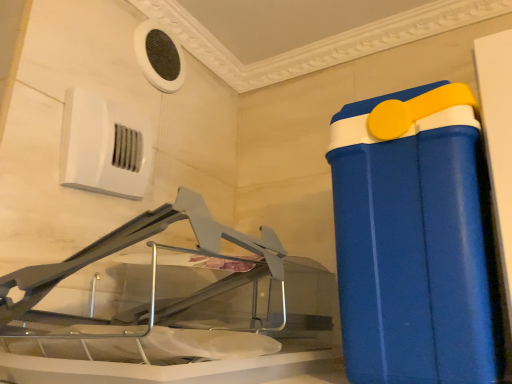
Question: From the image's perspective, is white plastic air conditioning unit at upper left, which appears as the 1th air conditioning when viewed from the front, below white mesh air conditioning at upper left, which is the 1th air conditioning in top-to-bottom order?

Choices:
 (A) yes
 (B) no

Answer: (A)

Question: From a real-world perspective, is white plastic air conditioning unit at upper left, the second air conditioning in the top-to-bottom sequence, on white mesh air conditioning at upper left, acting as the 2th air conditioning starting from the bottom?

Choices:
 (A) yes
 (B) no

Answer: (B)

Question: Can white mesh air conditioning at upper left, the 2th air conditioning when ordered from front to back, be found inside white plastic air conditioning unit at upper left, arranged as the second air conditioning when viewed from the back?

Choices:
 (A) no
 (B) yes

Answer: (A)

Question: Does white plastic air conditioning unit at upper left, which appears as the 1th air conditioning when viewed from the front, have a lesser width compared to white mesh air conditioning at upper left, the 2th air conditioning when ordered from front to back?

Choices:
 (A) no
 (B) yes

Answer: (A)

Question: Is white plastic air conditioning unit at upper left, the second air conditioning in the top-to-bottom sequence, smaller than white mesh air conditioning at upper left, which is the 1th air conditioning in top-to-bottom order?

Choices:
 (A) no
 (B) yes

Answer: (A)

Question: Based on their positions, is blue plastic container at right located to the left or right of white mesh air conditioning at upper left, which is the 1th air conditioning in top-to-bottom order?

Choices:
 (A) left
 (B) right

Answer: (B)

Question: From the image's perspective, is blue plastic container at right positioned above or below white mesh air conditioning at upper left, acting as the 2th air conditioning starting from the bottom?

Choices:
 (A) below
 (B) above

Answer: (A)

Question: Considering the positions of blue plastic container at right and white mesh air conditioning at upper left, which is the 1th air conditioning in top-to-bottom order, in the image, is blue plastic container at right bigger or smaller than white mesh air conditioning at upper left, which is the 1th air conditioning in top-to-bottom order,?

Choices:
 (A) small
 (B) big

Answer: (B)

Question: Considering the positions of blue plastic container at right and white mesh air conditioning at upper left, acting as the 2th air conditioning starting from the bottom, in the image, is blue plastic container at right taller or shorter than white mesh air conditioning at upper left, acting as the 2th air conditioning starting from the bottom,?

Choices:
 (A) short
 (B) tall

Answer: (B)

Question: Relative to blue plastic container at right, is white plastic air conditioning unit at upper left, arranged as the second air conditioning when viewed from the back, in front or behind?

Choices:
 (A) front
 (B) behind

Answer: (B)

Question: From the image's perspective, is white plastic air conditioning unit at upper left, the second air conditioning in the top-to-bottom sequence, positioned above or below blue plastic container at right?

Choices:
 (A) above
 (B) below

Answer: (A)

Question: From their relative heights in the image, would you say white plastic air conditioning unit at upper left, the second air conditioning in the top-to-bottom sequence, is taller or shorter than blue plastic container at right?

Choices:
 (A) tall
 (B) short

Answer: (B)

Question: Looking at the image, does white plastic air conditioning unit at upper left, the second air conditioning in the top-to-bottom sequence, seem bigger or smaller compared to blue plastic container at right?

Choices:
 (A) big
 (B) small

Answer: (B)

Question: Is white mesh air conditioning at upper left, which is the 1th air conditioning in top-to-bottom order, situated inside blue plastic container at right or outside?

Choices:
 (A) outside
 (B) inside

Answer: (A)

Question: In the image, is white mesh air conditioning at upper left, which is the 1th air conditioning in top-to-bottom order, positioned in front of or behind blue plastic container at right?

Choices:
 (A) front
 (B) behind

Answer: (B)